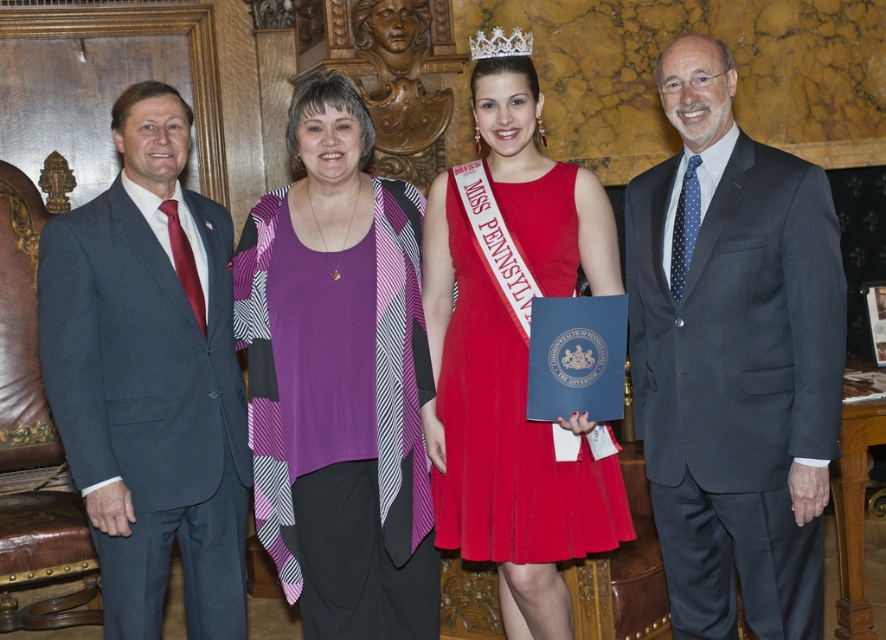
In the group photo, there is a point at coordinates (340, 380). Which object is this point located on?

The point at coordinates (340, 380) is located on the purple knit top at center.

You are a photographer adjusting the camera focus. You need to ensure both the dark blue suit at left and the silver metallic tiara at upper center are in focus. Which object requires a wider aperture to capture its details clearly?

The dark blue suit at left requires a wider aperture because it is larger in width than the silver metallic tiara at upper center, necessitating a shallower depth of field to focus on its broader details.

You are a photographer adjusting the camera settings for the group photo. You notice the dark gray suit at right and the purple knit top at center. Which clothing item appears taller in the photo?

The purple knit top at center appears taller than the dark gray suit at right in the photo.